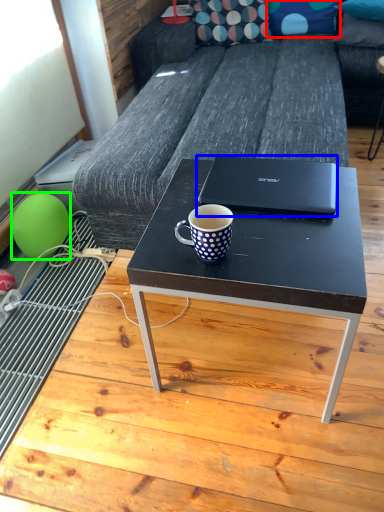
Question: Estimate the real-world distances between objects in this image. Which object is farther from pillow (highlighted by a red box), laptop (highlighted by a blue box) or balloon (highlighted by a green box)?

Choices:
 (A) laptop
 (B) balloon

Answer: (B)